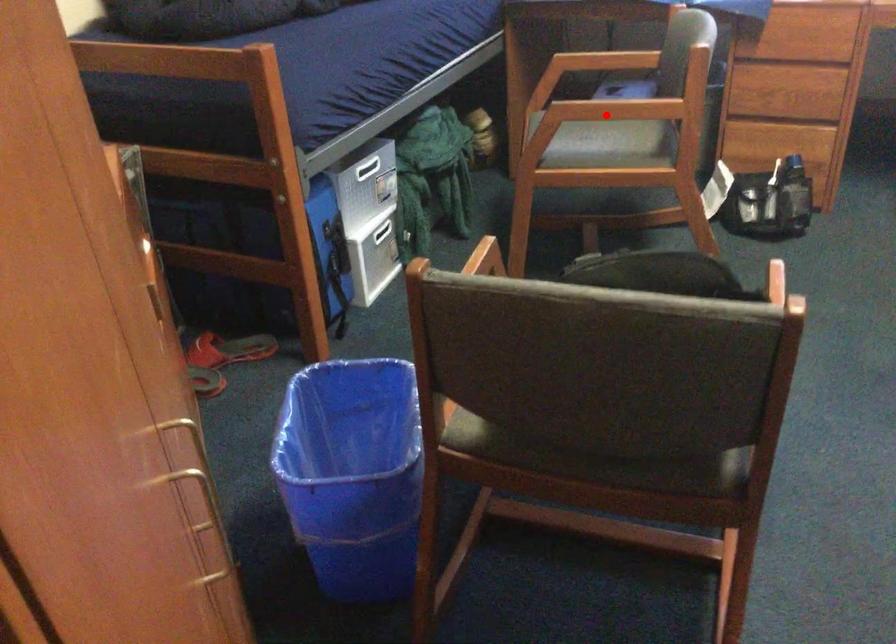
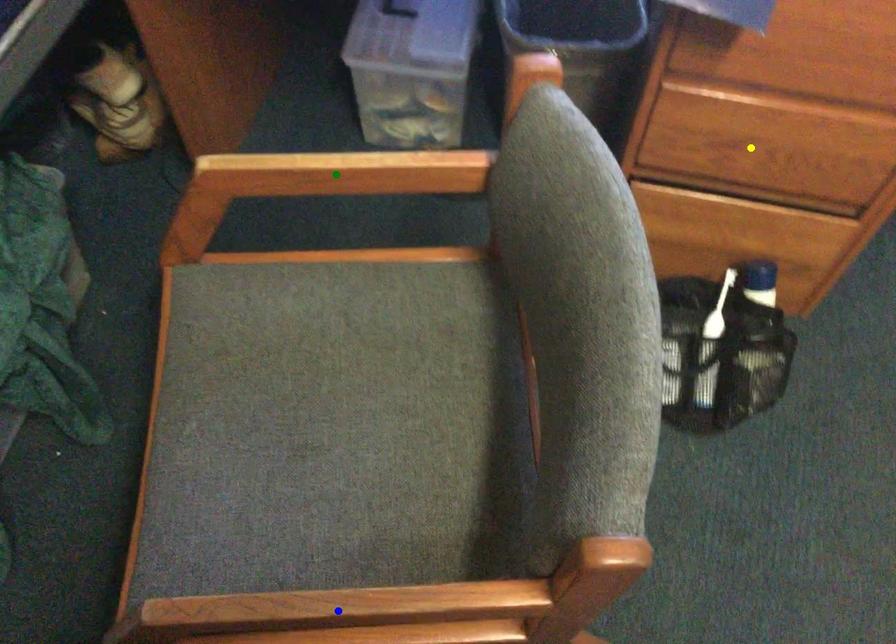
Question: I am providing you with two images of the same scene from different viewpoints. A red point is marked on the first image. You are given multiple points on the second image. In image 2, which mark is for the same physical point as the one in image 1?

Choices:
 (A) blue point
 (B) yellow point
 (C) green point

Answer: (A)